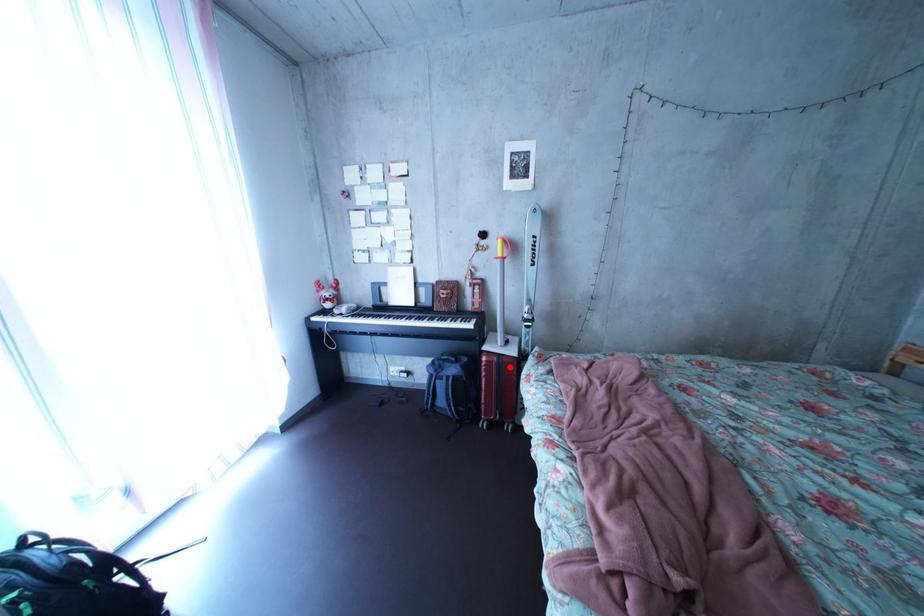
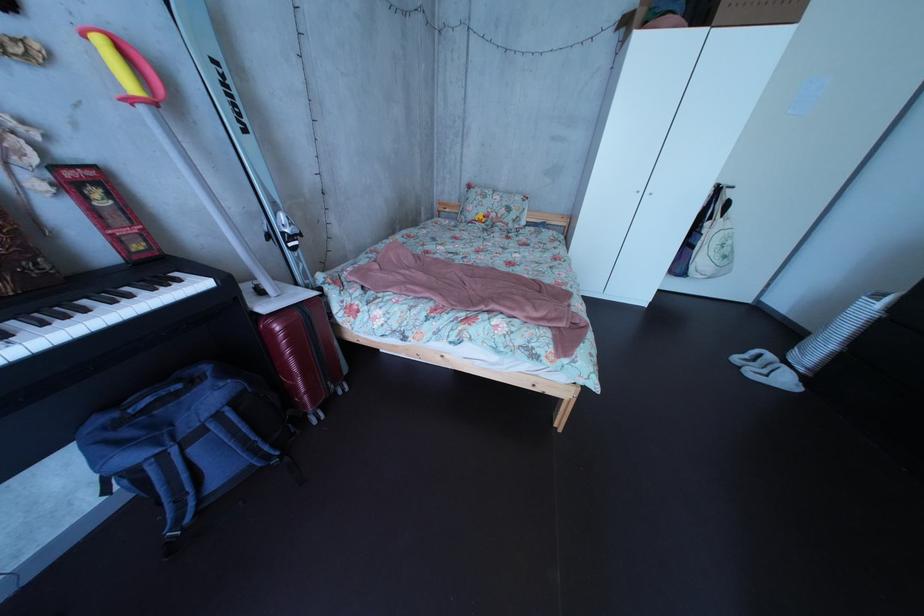
Find the pixel in the second image that matches the highlighted location in the first image.

(311, 322)